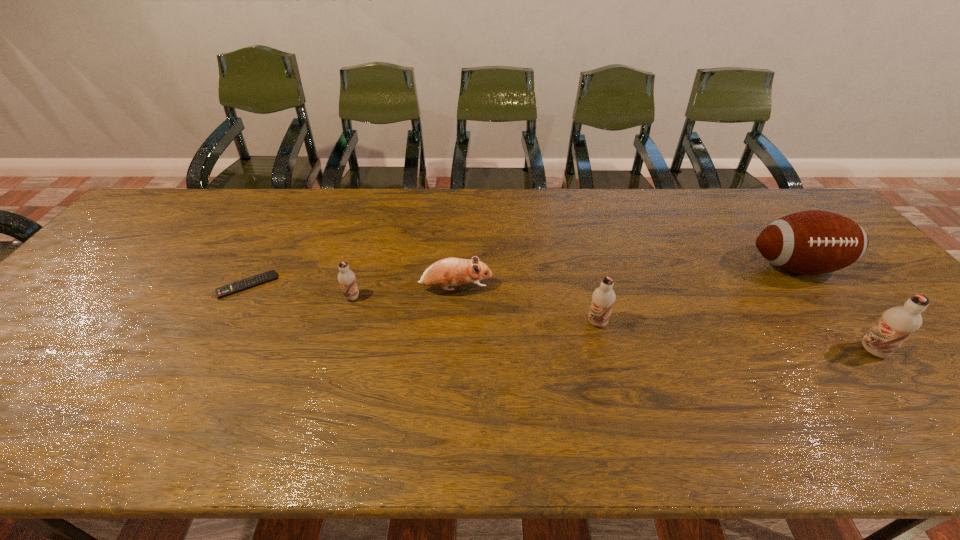
The width and height of the screenshot is (960, 540). What are the coordinates of `unoccupied area between the rightmost chocolate milk and the fifth object from right to left` in the screenshot? It's located at (612, 324).

Where is `free space between the fifth object from right to left and the nearest object`? This screenshot has height=540, width=960. free space between the fifth object from right to left and the nearest object is located at coordinates (612, 324).

The image size is (960, 540). I want to click on empty location between the second nearest chocolate milk and the fourth object from right to left, so pos(526,306).

The image size is (960, 540). Identify the location of free space between the rightmost chocolate milk and the third object from left to right. (664, 320).

Select which object is the fifth closest to the shortest chocolate milk. Please provide its 2D coordinates. Your answer should be formatted as a tuple, i.e. [(x, y)], where the tuple contains the x and y coordinates of a point satisfying the conditions above.

[(896, 324)]

Identify the location of the second closest object to the second tallest chocolate milk. This screenshot has height=540, width=960. (813, 242).

Locate an element on the screen. The image size is (960, 540). the second closest chocolate milk to the football is located at coordinates (603, 298).

At what (x,y) coordinates should I click in order to perform the action: click on chocolate milk that is the closest to the second tallest chocolate milk. Please return your answer as a coordinate pair (x, y). Looking at the image, I should click on (896, 324).

The height and width of the screenshot is (540, 960). Identify the location of blank space that satisfies the following two spatial constraints: 1. on the laces of the nearest object; 2. on the right side of the football. (862, 350).

Where is `free location that satisfies the following two spatial constraints: 1. on the laces of the football; 2. on the right side of the rightmost chocolate milk`? This screenshot has width=960, height=540. free location that satisfies the following two spatial constraints: 1. on the laces of the football; 2. on the right side of the rightmost chocolate milk is located at coordinates [x=862, y=350].